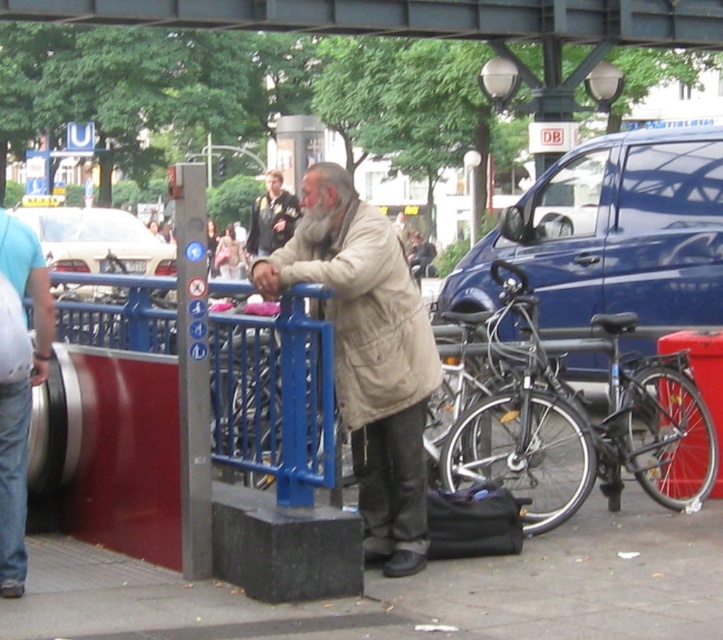
Which is below, silver metallic bicycle at center or light blue denim jeans at lower left?

Positioned lower is silver metallic bicycle at center.

Does point (667, 442) come behind point (9, 438)?

Yes, it is.

Which is in front, point (641, 484) or point (35, 369)?

Point (35, 369) is in front.

This screenshot has height=640, width=723. I want to click on silver metallic bicycle at center, so click(576, 417).

Can you confirm if metallic blue van at center is shorter than white glossy car at upper left?

Correct, metallic blue van at center is not as tall as white glossy car at upper left.

You are a GUI agent. You are given a task and a screenshot of the screen. Output one action in this format:
    pyautogui.click(x=<x>, y=<y>)
    Task: Click on the metallic blue van at center
    This screenshot has width=723, height=640.
    Given the screenshot: What is the action you would take?
    pyautogui.click(x=612, y=234)

Who is more distant from viewer, (562, 173) or (61, 243)?

The point (61, 243) is more distant.

This screenshot has width=723, height=640. I want to click on metallic blue van at center, so click(x=612, y=234).

Does metallic blue van at center have a larger size compared to gray matte beard at center?

Indeed, metallic blue van at center has a larger size compared to gray matte beard at center.

Find the location of a particular element. metallic blue van at center is located at coordinates (612, 234).